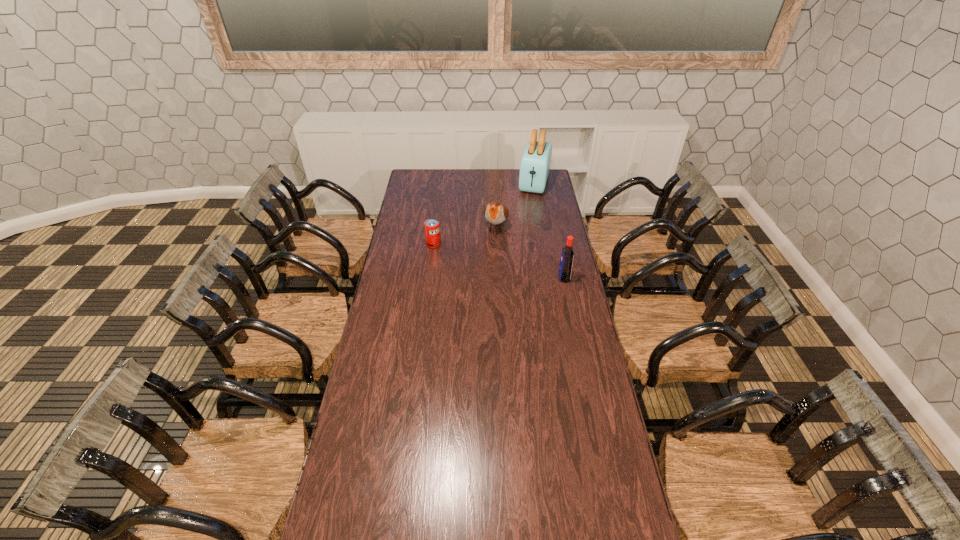
What are the coordinates of `vacant space located at the face of the second farthest object` in the screenshot? It's located at (486, 261).

In order to click on vacant space located at the face of the second farthest object in this screenshot , I will do `click(488, 255)`.

Where is `vacant space situated 0.150m on the side of the tallest object with the lever`? vacant space situated 0.150m on the side of the tallest object with the lever is located at coordinates (529, 211).

I want to click on vacant space located 0.150m on the side of the tallest object with the lever, so click(529, 211).

Locate an element on the screen. The image size is (960, 540). vacant region located 0.080m on the side of the tallest object with the lever is located at coordinates tap(531, 204).

What are the coordinates of `object that is at the far edge` in the screenshot? It's located at (535, 164).

You are a GUI agent. You are given a task and a screenshot of the screen. Output one action in this format:
    pyautogui.click(x=<x>, y=<y>)
    Task: Click on the vodka positioned at the right edge
    
    Given the screenshot: What is the action you would take?
    pyautogui.click(x=565, y=267)

Identify the location of toaster that is at the right edge. This screenshot has width=960, height=540. pos(535,164).

I want to click on object that is at the far right corner, so click(x=535, y=164).

In the image, there is a desktop. Identify the location of vacant space at the far edge. (456, 177).